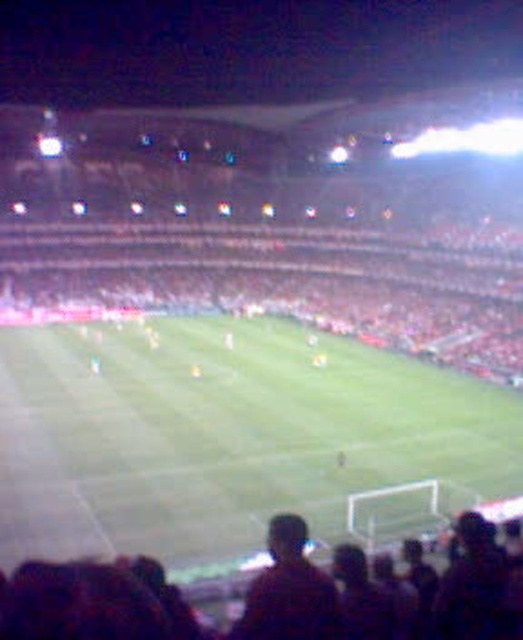
Question: Which object is the farthest from the green grass football field at center?

Choices:
 (A) dark brown hair at center
 (B) dark brown hair at lower center

Answer: (A)

Question: Is dark brown hair at lower center below dark brown hair at center?

Choices:
 (A) no
 (B) yes

Answer: (B)

Question: Which object is positioned farthest from the green grass football field at center?

Choices:
 (A) dark brown hair at center
 (B) dark brown hair at lower center

Answer: (A)

Question: Is the position of dark brown hair at lower center less distant than that of dark brown hair at center?

Choices:
 (A) no
 (B) yes

Answer: (B)

Question: Can you confirm if dark brown hair at lower center is thinner than dark brown hair at center?

Choices:
 (A) no
 (B) yes

Answer: (A)

Question: Considering the real-world distances, which object is farthest from the green grass football field at center?

Choices:
 (A) dark brown hair at center
 (B) dark brown hair at lower center

Answer: (A)